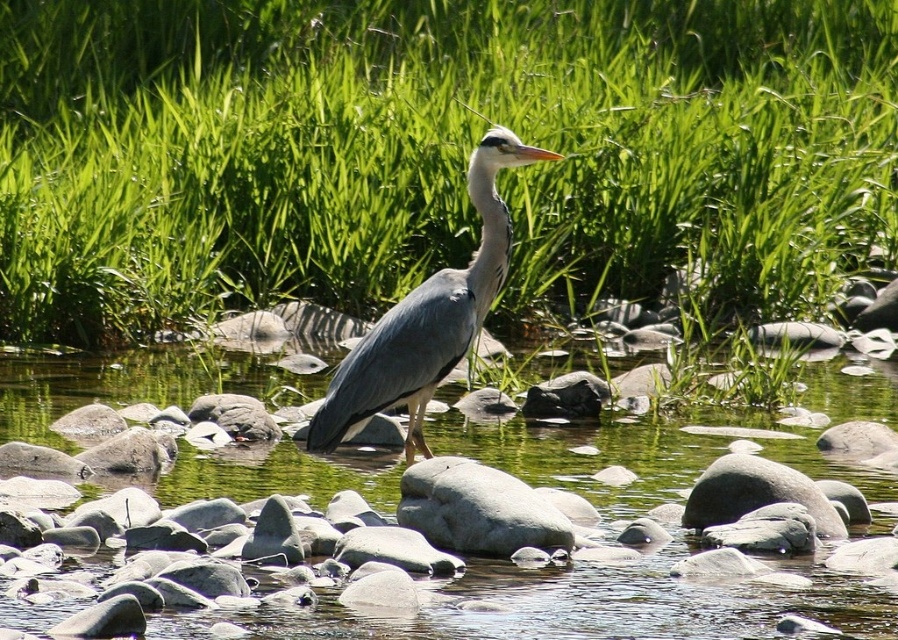
Question: Can you confirm if green grass at upper center is wider than gray matte heron at center?

Choices:
 (A) no
 (B) yes

Answer: (B)

Question: Estimate the real-world distances between objects in this image. Which object is closer to the gray smooth rock at center-right?

Choices:
 (A) green smooth water at center
 (B) green grass at upper center
 (C) gray smooth rock at center
 (D) gray matte heron at center

Answer: (C)

Question: Which point is farther to the camera?

Choices:
 (A) gray smooth rock at center
 (B) green grass at upper center

Answer: (A)

Question: Can you confirm if green smooth water at center is positioned to the left of gray smooth rock at center?

Choices:
 (A) no
 (B) yes

Answer: (B)

Question: Is green smooth water at center wider than gray smooth rock at center-right?

Choices:
 (A) yes
 (B) no

Answer: (A)

Question: Which point is closer to the camera?

Choices:
 (A) gray matte heron at center
 (B) green smooth water at center

Answer: (B)